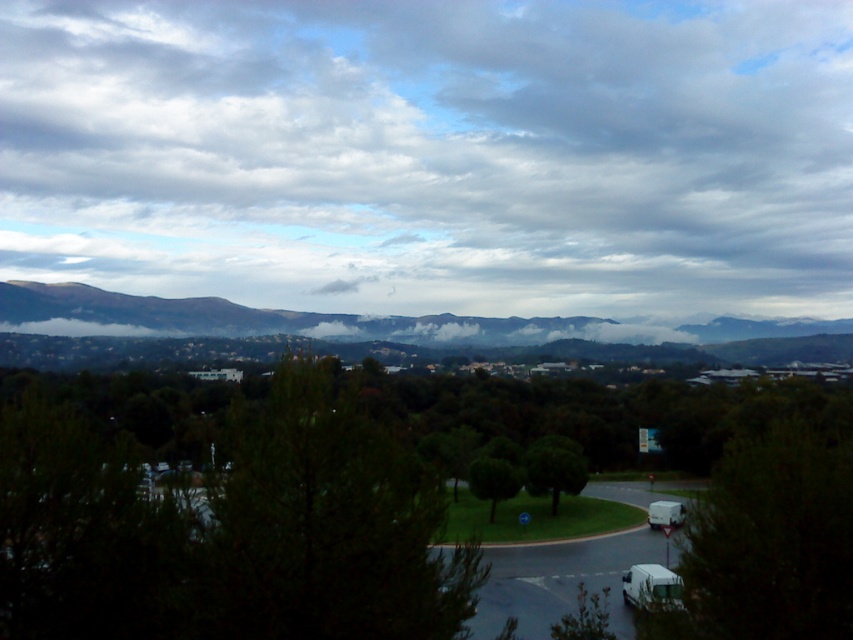
Who is higher up, green mossy hillside at center or green leafy tree at center?

green mossy hillside at center

Between point (53, 324) and point (556, 490), which one is positioned in front?

Point (556, 490) is in front.

Where is `green mossy hillside at center`? This screenshot has width=853, height=640. green mossy hillside at center is located at coordinates (346, 321).

You are a GUI agent. You are given a task and a screenshot of the screen. Output one action in this format:
    pyautogui.click(x=<x>, y=<y>)
    Task: Click on the green mossy hillside at center
    
    Given the screenshot: What is the action you would take?
    pyautogui.click(x=346, y=321)

Can you confirm if green matte tree at center is thinner than green leafy tree at center?

In fact, green matte tree at center might be wider than green leafy tree at center.

Is point (91, 563) farther from camera compared to point (534, 440)?

No, (91, 563) is closer to viewer.

Locate an element on the screen. The width and height of the screenshot is (853, 640). green matte tree at center is located at coordinates (228, 520).

Which is in front, point (495, 52) or point (45, 328)?

Point (45, 328)

Who is positioned more to the left, cloudy sky at upper center or green mossy hillside at center?

From the viewer's perspective, cloudy sky at upper center appears more on the left side.

Between point (9, 177) and point (701, 330), which one is positioned behind?

The point (9, 177) is behind.

I want to click on cloudy sky at upper center, so click(x=434, y=154).